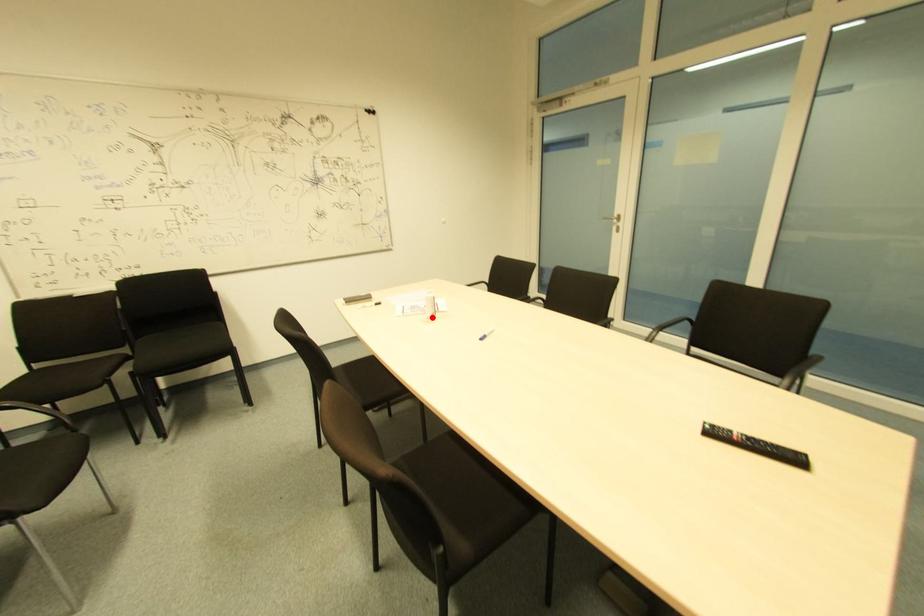
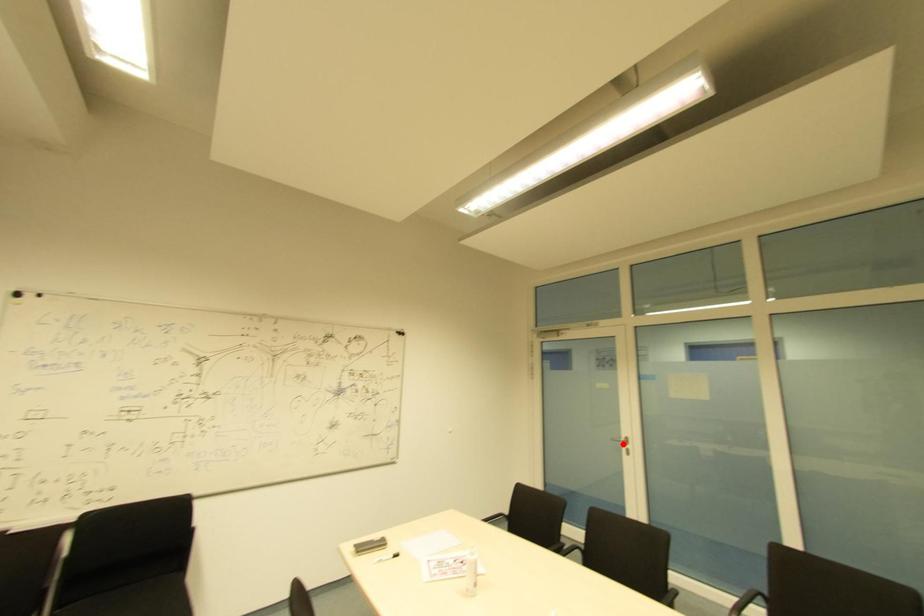
I am providing you with two images of the same scene from different viewpoints. A red point is marked on the first image and another point is marked on the second image. Do the highlighted points in image1 and image2 indicate the same real-world spot?

No